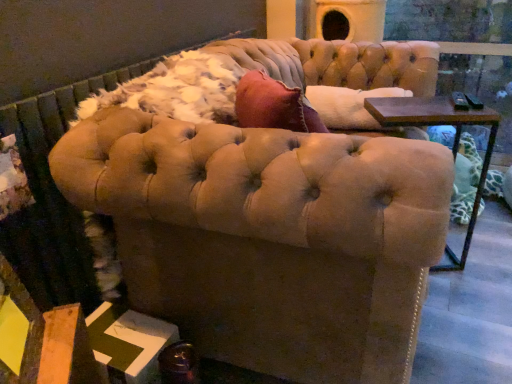
Question: Does point (503, 69) appear closer or farther from the camera than point (140, 162)?

Choices:
 (A) closer
 (B) farther

Answer: (B)

Question: Would you say transparent glass door at upper right is to the left or to the right of suede beige chair at center in the picture?

Choices:
 (A) right
 (B) left

Answer: (A)

Question: From the image's perspective, is transparent glass door at upper right located above or below suede beige chair at center?

Choices:
 (A) below
 (B) above

Answer: (B)

Question: Considering their positions, is suede beige chair at center located in front of or behind transparent glass door at upper right?

Choices:
 (A) front
 (B) behind

Answer: (A)

Question: Choose the correct answer: Is suede beige chair at center inside transparent glass door at upper right or outside it?

Choices:
 (A) outside
 (B) inside

Answer: (A)

Question: From a real-world perspective, relative to transparent glass door at upper right, is suede beige chair at center vertically above or below?

Choices:
 (A) above
 (B) below

Answer: (B)

Question: Considering the positions of suede beige chair at center and transparent glass door at upper right in the image, is suede beige chair at center bigger or smaller than transparent glass door at upper right?

Choices:
 (A) small
 (B) big

Answer: (B)